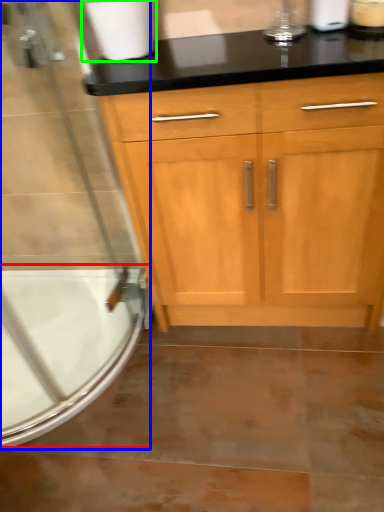
Question: Which object is positioned closest to bath (highlighted by a red box)? Select from screen door (highlighted by a blue box) and toilet paper (highlighted by a green box).

Choices:
 (A) screen door
 (B) toilet paper

Answer: (A)